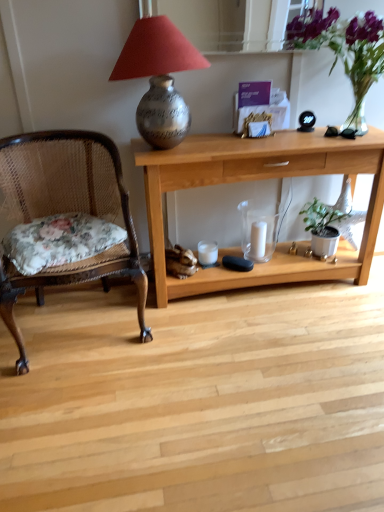
Question: Based on their sizes in the image, would you say light wood desk at center is bigger or smaller than transparent glass candle holder at center, which ranks as the 2th candle holder in left-to-right order?

Choices:
 (A) big
 (B) small

Answer: (A)

Question: In the image, is light wood desk at center on the left side or the right side of transparent glass candle holder at center, the 1th candle holder in the right-to-left sequence?

Choices:
 (A) left
 (B) right

Answer: (A)

Question: Which of these objects is positioned farthest from the green matte plant at lower right?

Choices:
 (A) white matte candle at center
 (B) purple glass vase at upper right
 (C) white matte candle holder at center, which appears as the 2th candle holder when viewed from the right
 (D) light wood desk at center
 (E) woven wood chair with floral cushion at left

Answer: (E)

Question: Considering the real-world distances, which object is farthest from the white matte candle at center?

Choices:
 (A) light wood desk at center
 (B) silver textured vase at upper center
 (C) purple glass vase at upper right
 (D) white matte candle holder at center, which is counted as the 1th candle holder, starting from the left
 (E) transparent glass candle holder at center, the 1th candle holder in the right-to-left sequence

Answer: (C)